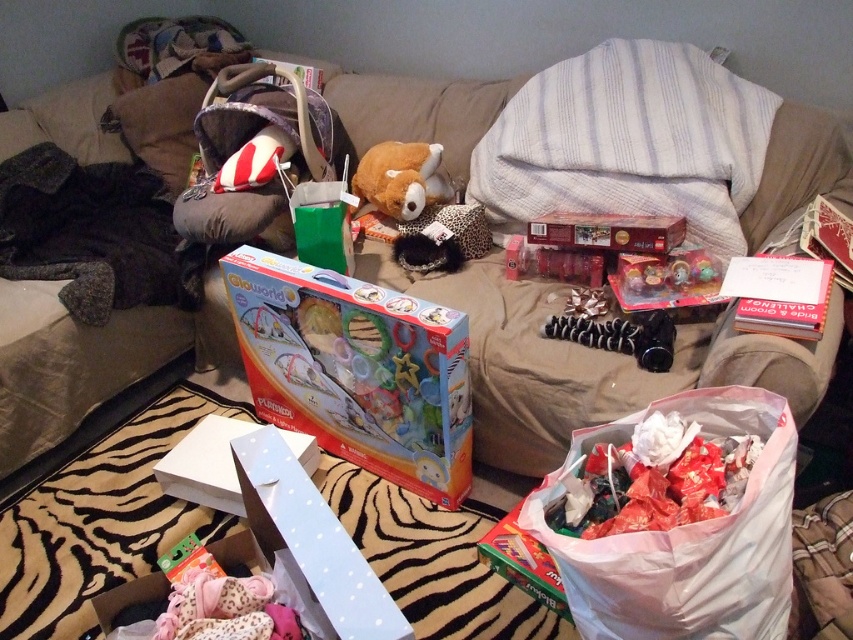
You are a delivery person who needs to place a new package on the sofa. The package is 32 inches long. There is a multicolored cardboard box at center and a white paper at upper right. Can you fit the package between them?

The multicolored cardboard box at center and white paper at upper right are 31.81 inches apart from each other, so the package is 0.19 inches too long to fit between them.

You are organizing the items on the sofa and need to place a new decorative pillow. The sofa has a coordinate system where the top left corner is the origin. Where exactly should you place the new pillow to avoid overlapping with the velvety brown pillow at upper left?

The velvety brown pillow at upper left is located at point (160, 124), so you should place the new pillow at a different coordinate to avoid overlapping with it.